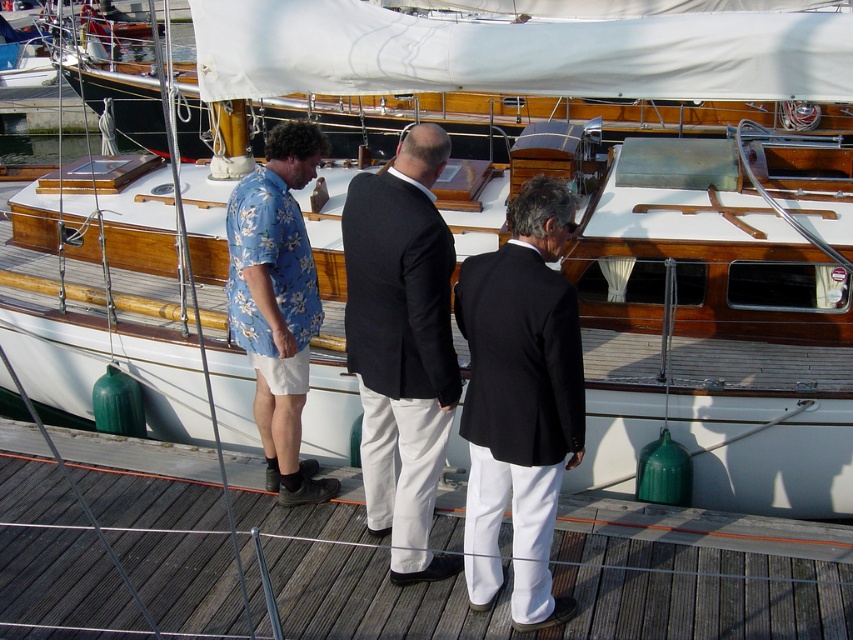
Which is behind, point (529, 586) or point (241, 195)?

The point (241, 195) is more distant.

Is black matte suit at center above blue floral shirt at left?

No, black matte suit at center is not above blue floral shirt at left.

Is point (521, 264) closer to camera compared to point (254, 314)?

That is True.

What are the coordinates of `black matte suit at center` in the screenshot? It's located at (520, 401).

Which is in front, point (532, 452) or point (416, 250)?

Positioned in front is point (532, 452).

Find the location of a particular element. black matte suit at center is located at coordinates (520, 401).

The width and height of the screenshot is (853, 640). I want to click on black matte suit at center, so coord(520,401).

What do you see at coordinates (402, 344) in the screenshot? I see `matte black suit at center` at bounding box center [402, 344].

Between point (392, 564) and point (283, 240), which one is positioned in front?

Point (283, 240) is in front.

Find the location of `matte black suit at center`. matte black suit at center is located at coordinates (402, 344).

I want to click on matte black suit at center, so click(x=402, y=344).